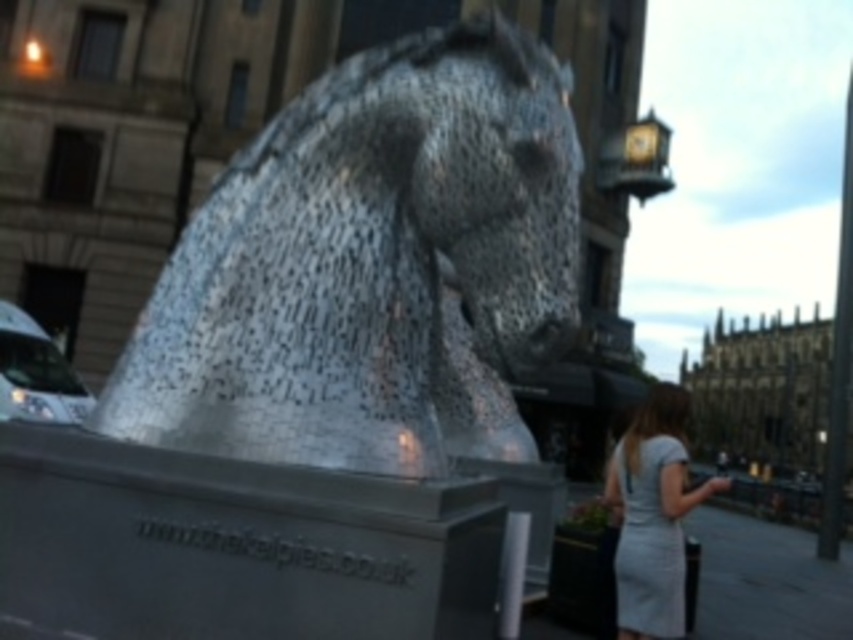
Question: Does shiny metallic horse at center appear under light gray dress at lower right?

Choices:
 (A) no
 (B) yes

Answer: (A)

Question: Among these points, which one is nearest to the camera?

Choices:
 (A) (370, 428)
 (B) (631, 637)

Answer: (A)

Question: Which point is closer to the camera taking this photo?

Choices:
 (A) (442, 184)
 (B) (624, 448)

Answer: (A)

Question: From the image, what is the correct spatial relationship of shiny metallic horse at center in relation to light gray dress at lower right?

Choices:
 (A) below
 (B) above

Answer: (B)

Question: Which point is closer to the camera taking this photo?

Choices:
 (A) (639, 492)
 (B) (560, 291)

Answer: (B)

Question: Can you confirm if shiny metallic horse at center is bigger than light gray dress at lower right?

Choices:
 (A) yes
 (B) no

Answer: (B)